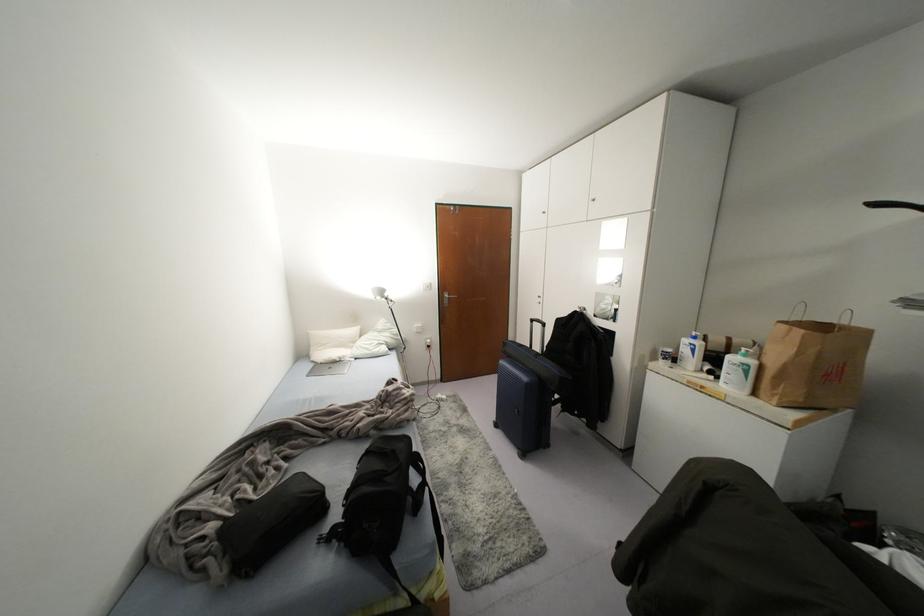
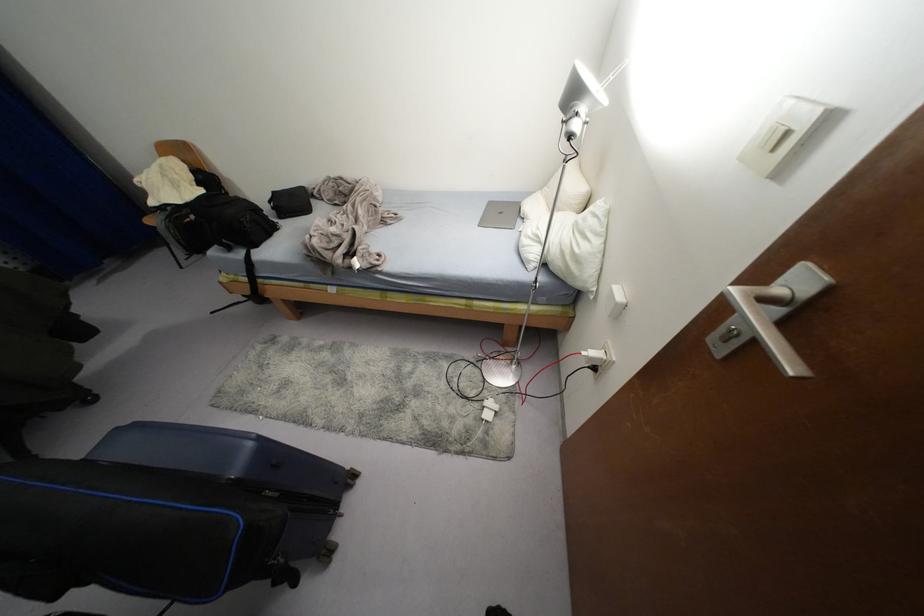
Locate, in the second image, the point that corresponds to the point at 391,338 in the first image.

(561, 251)